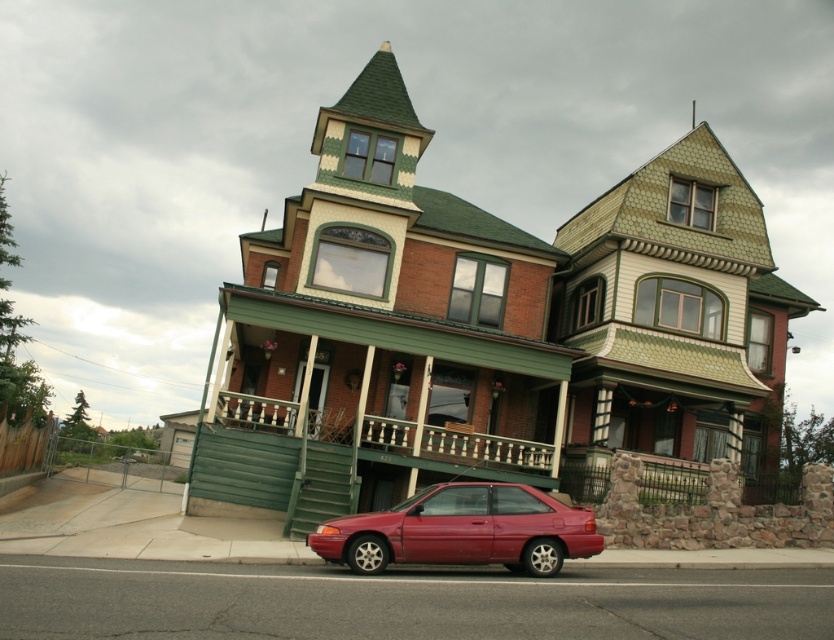
You are a delivery person trying to park your shiny red car at lower center near the green painted wood porch at center. Since the driveway is narrow, you need to know which object takes up more space. Which one is bigger?

The shiny red car at lower center is larger in size than the green painted wood porch at center, so the car takes up more space and might not fit in the narrow driveway.

You are standing on the sidewalk in front of the Victorian house and see the shiny red car at lower center and the green painted wood porch at center. Which object is positioned to the right side from your viewpoint?

The shiny red car at lower center is positioned to the right of the green painted wood porch at center, so the shiny red car at lower center is on the right side from your viewpoint.

You are a delivery person trying to park your 5.5 meter long truck next to the shiny red car at lower center. The truck needs to be parked parallel to the car. The green painted wood porch at center is in the way. Can you park your truck there without hitting the porch?

The shiny red car at lower center is 7.95 meters from the green painted wood porch at center. Since the truck is only 5.5 meters long, there is enough space between the car and the porch to park the truck parallel to the car without hitting the porch.